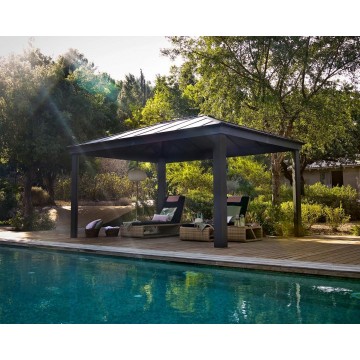
What are the coordinates of `wicker baskets` in the screenshot? It's located at click(x=96, y=231), click(x=116, y=232).